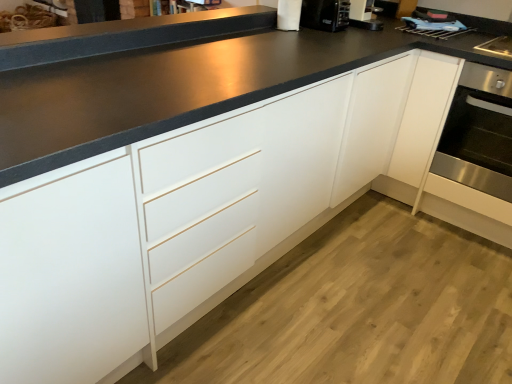
The width and height of the screenshot is (512, 384). In order to click on vacant space to the right of black plastic coffee machine at upper right in this screenshot , I will do `click(362, 36)`.